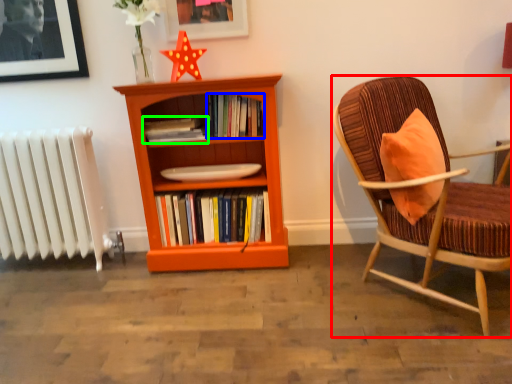
Question: Based on their relative distances, which object is nearer to chair (highlighted by a red box)? Choose from book (highlighted by a blue box) and book (highlighted by a green box).

Choices:
 (A) book
 (B) book

Answer: (A)